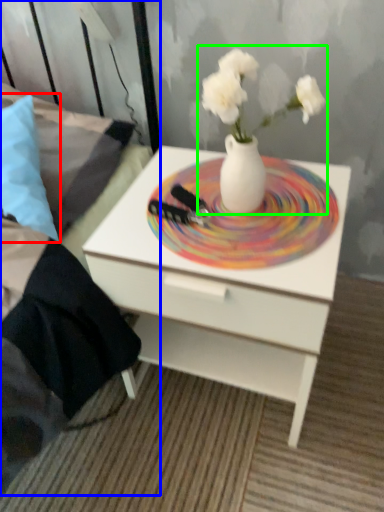
Question: Based on their relative distances, which object is nearer to pillow (highlighted by a red box)? Choose from bed frame (highlighted by a blue box) and floral arrangement (highlighted by a green box).

Choices:
 (A) bed frame
 (B) floral arrangement

Answer: (A)